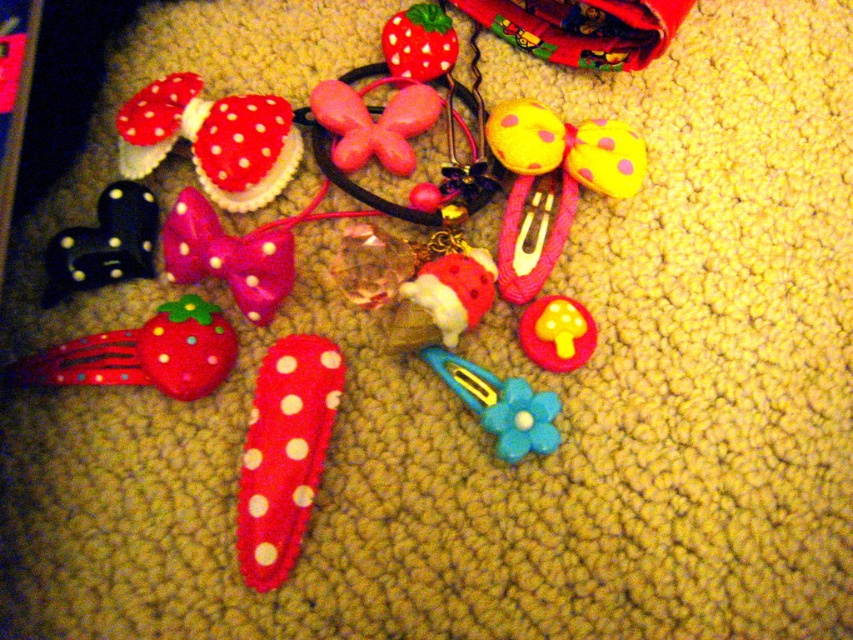
You are organizing the hair accessories on the carpet. You need to place the blue felt flower at center and the white polka dot fabric mushroom at upper left side by side. Which one requires more space horizontally?

The blue felt flower at center requires more space horizontally because its width surpasses that of the white polka dot fabric mushroom at upper left.

You are a customer at a boutique store and want to choose between the pink felt bow at center and the matte felt strawberry at upper center. Which one is wider?

The pink felt bow at center is wider than the matte felt strawberry at upper center.

You are a customer at a boutique and see the pink felt bow at center and the matte felt strawberry at upper center displayed on the carpet. Which accessory would you choose if you want the larger one?

The pink felt bow at center is larger in size than the matte felt strawberry at upper center, so you should choose the pink felt bow at center.